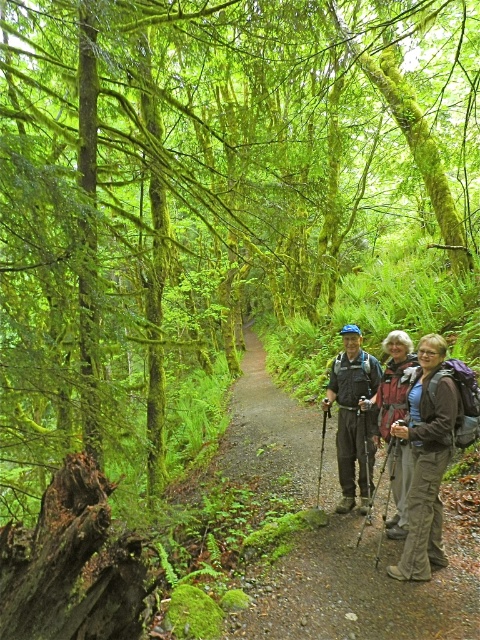
Question: Which point is farther from the camera taking this photo?

Choices:
 (A) (x=458, y=605)
 (B) (x=361, y=348)
 (C) (x=436, y=371)

Answer: (B)

Question: Is gravel path at center positioned behind matte gray jacket at center?

Choices:
 (A) yes
 (B) no

Answer: (B)

Question: Estimate the real-world distances between objects in this image. Which object is closer to the brown fabric backpack at right?

Choices:
 (A) matte gray jacket at center
 (B) gravel path at center

Answer: (A)

Question: Which object is positioned farthest from the matte gray jacket at center?

Choices:
 (A) gravel path at center
 (B) brown fabric backpack at right

Answer: (A)

Question: In this image, where is matte gray jacket at center located relative to matte blue helmet at center?

Choices:
 (A) above
 (B) below

Answer: (B)

Question: Does gravel path at center appear under brown fabric backpack at right?

Choices:
 (A) yes
 (B) no

Answer: (A)